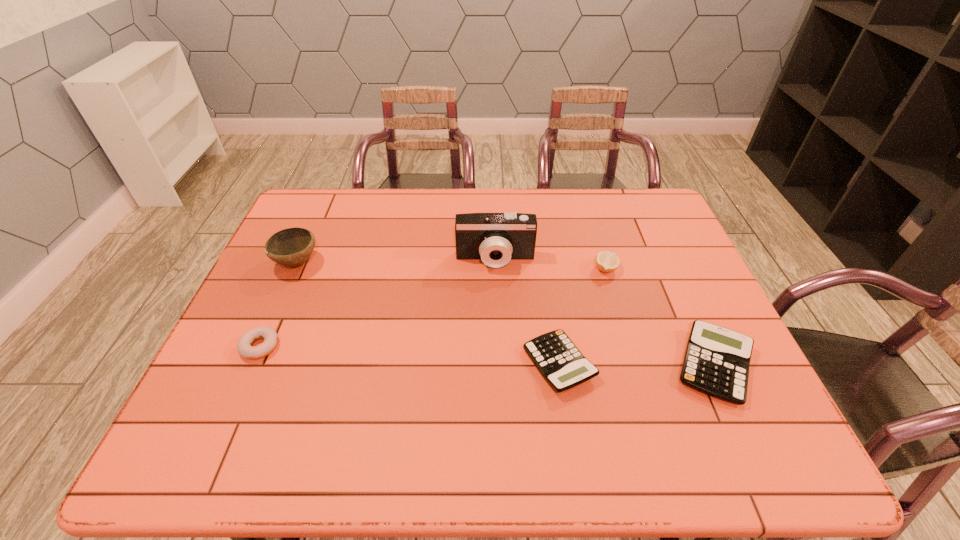
Locate an element on the screen. This screenshot has width=960, height=540. free point that keeps the calculators evenly spaced on the left is located at coordinates (405, 362).